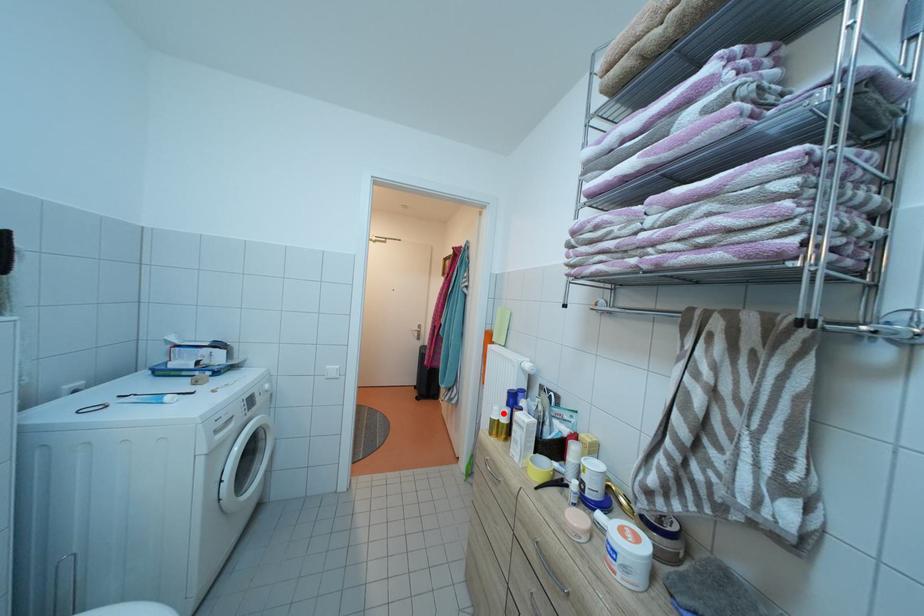
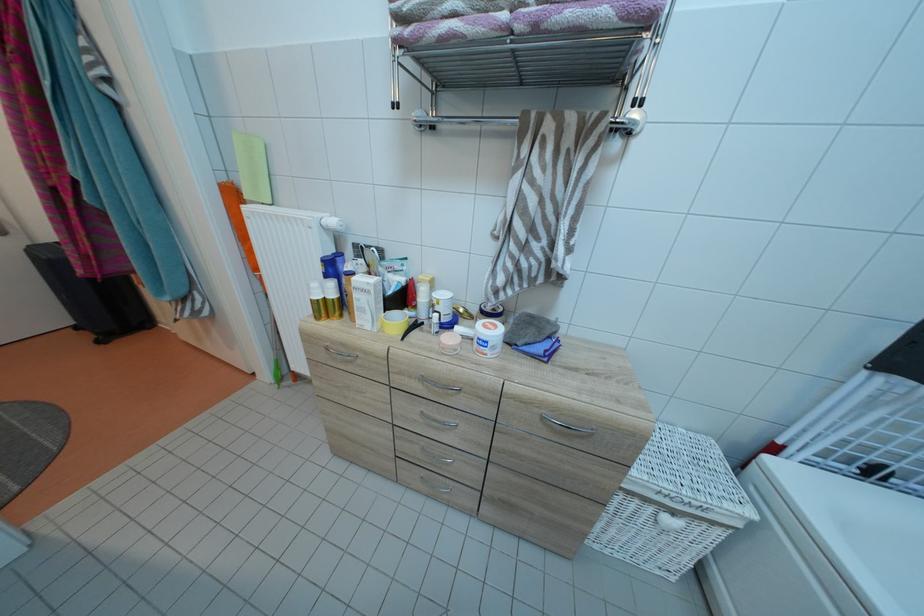
The point at the highlighted location is marked in the first image. Where is the corresponding point in the second image?

(322, 291)